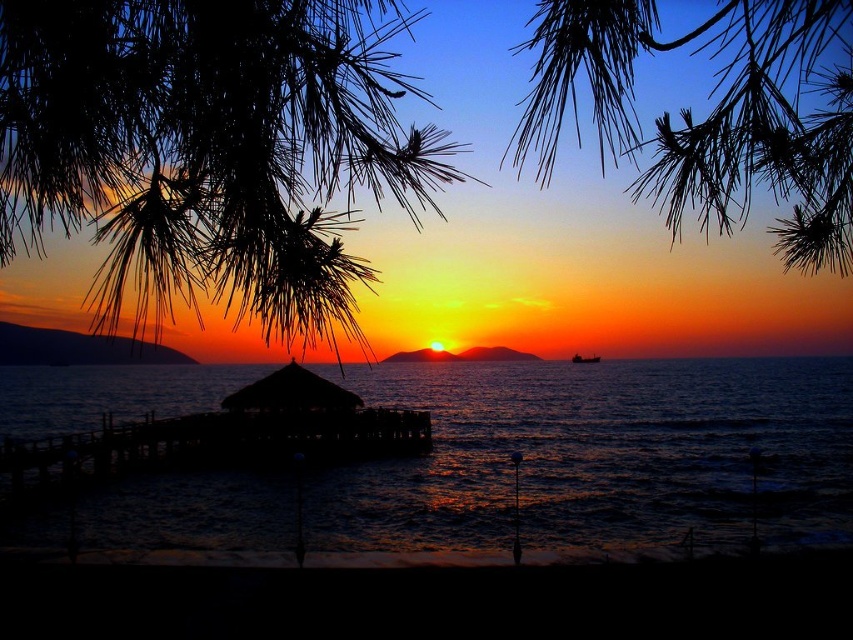
Question: Can you confirm if dark blue water at center is positioned above metallic gray ship at center?

Choices:
 (A) yes
 (B) no

Answer: (B)

Question: Which point is closer to the camera taking this photo?

Choices:
 (A) (254, 406)
 (B) (595, 362)

Answer: (A)

Question: Among these objects, which one is nearest to the camera?

Choices:
 (A) metallic gray ship at center
 (B) black wooden dock at lower center

Answer: (B)

Question: Is black wooden dock at lower center above metallic gray ship at center?

Choices:
 (A) no
 (B) yes

Answer: (B)

Question: Which point is farther to the camera?

Choices:
 (A) (598, 356)
 (B) (595, 81)
 (C) (825, 358)
 (D) (73, 456)

Answer: (C)

Question: Is silhouette thatched hut at center wider than metallic gray ship at center?

Choices:
 (A) yes
 (B) no

Answer: (A)